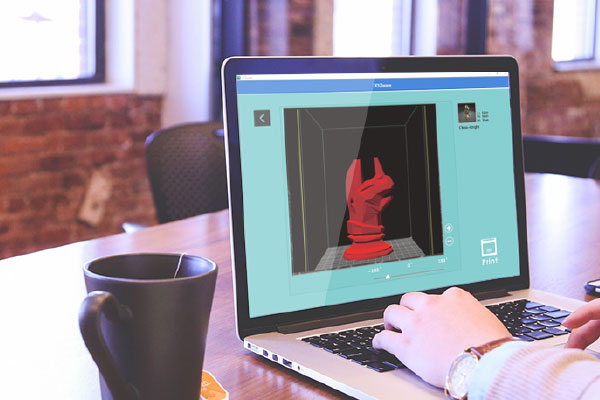
You are a GUI agent. You are given a task and a screenshot of the screen. Output one action in this format:
    pyautogui.click(x=<x>, y=<y>)
    Task: Click on the keyboard
    The width and height of the screenshot is (600, 400).
    Given the screenshot: What is the action you would take?
    pyautogui.click(x=515, y=314)